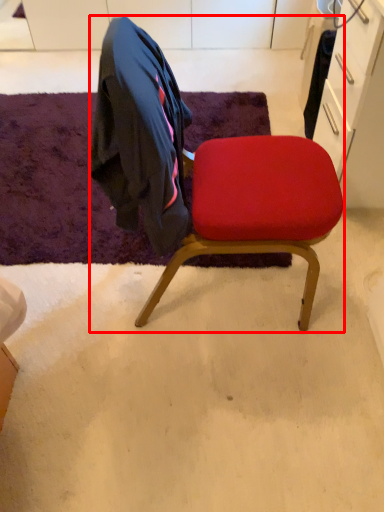
Question: From the image, what is the correct spatial relationship of chair (annotated by the red box) in relation to mat?

Choices:
 (A) left
 (B) right

Answer: (B)